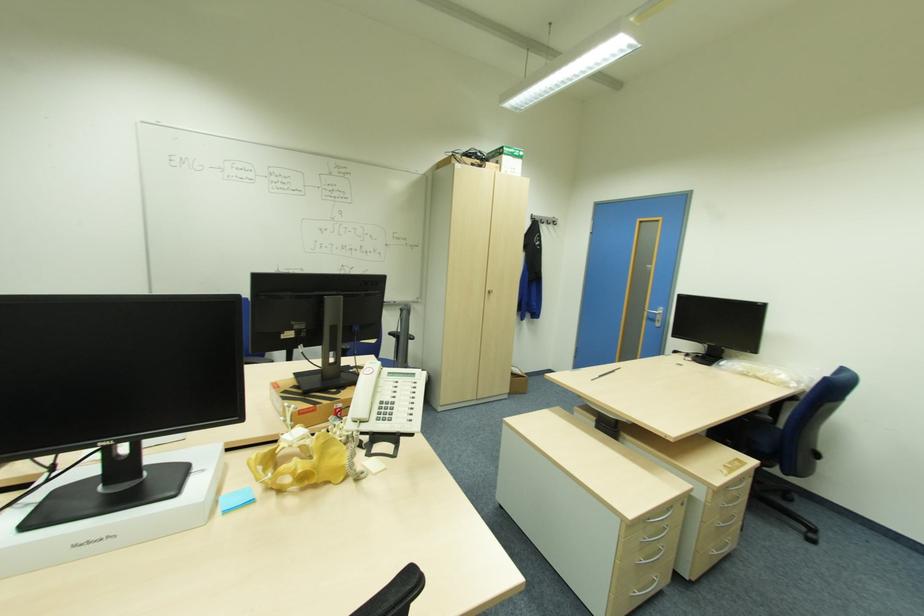
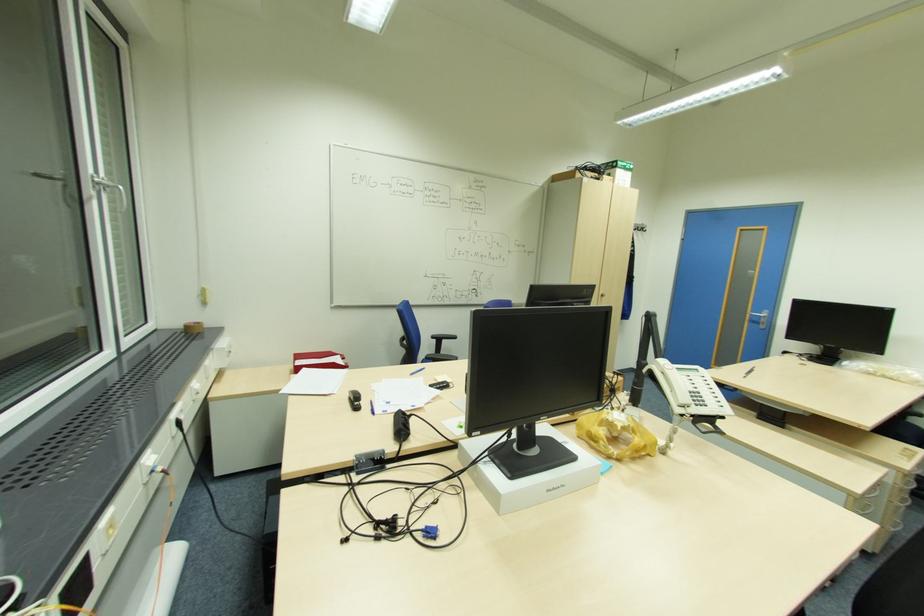
In the second image, find the point that corresponds to the point at 661,321 in the first image.

(766, 323)